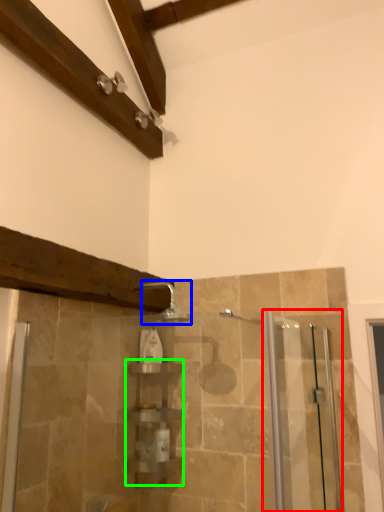
Question: Based on their relative distances, which object is nearer to screen door (highlighted by a red box)? Choose from shower (highlighted by a blue box) and shelf (highlighted by a green box).

Choices:
 (A) shower
 (B) shelf

Answer: (B)